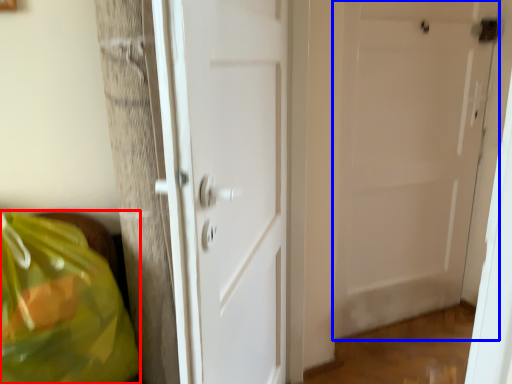
Question: Which point is closer to the camera, grocery bag (highlighted by a red box) or door (highlighted by a blue box)?

Choices:
 (A) grocery bag
 (B) door

Answer: (A)